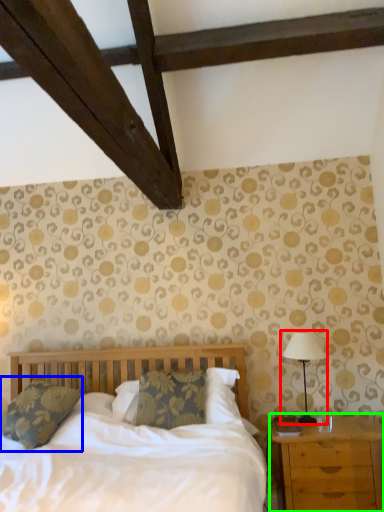
Question: Based on their relative distances, which object is farther from table lamp (highlighted by a red box)? Choose from pillow (highlighted by a blue box) and nightstand (highlighted by a green box).

Choices:
 (A) pillow
 (B) nightstand

Answer: (A)